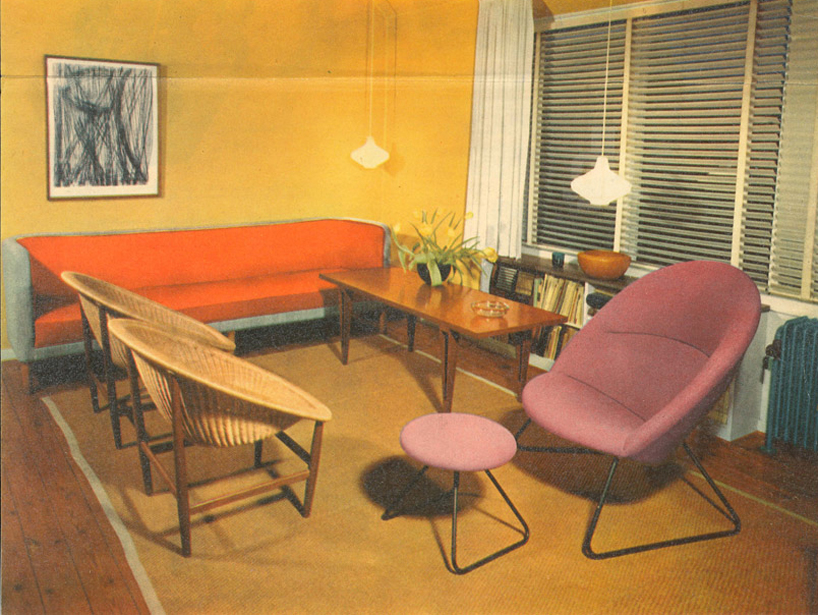
Where is `windows`? This screenshot has height=615, width=818. windows is located at coordinates pyautogui.click(x=724, y=146), pyautogui.click(x=577, y=131).